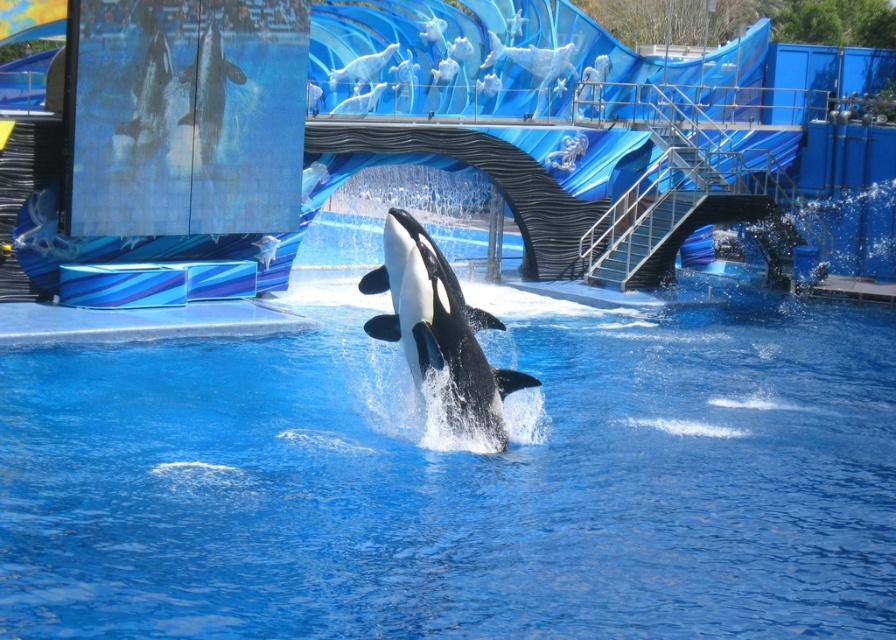
Does black smooth dolphin at upper left have a greater width compared to white smooth dolphin at upper left?

No, black smooth dolphin at upper left is not wider than white smooth dolphin at upper left.

Where is `black smooth dolphin at upper left`? black smooth dolphin at upper left is located at coordinates (145, 108).

Where is `black smooth dolphin at upper left`? Image resolution: width=896 pixels, height=640 pixels. black smooth dolphin at upper left is located at coordinates (145, 108).

In order to click on black smooth dolphin at upper left in this screenshot , I will do `click(145, 108)`.

Does black/white smooth orca at center appear over white smooth dolphin at upper left?

No.

Identify the location of black/white smooth orca at center. (438, 324).

Does point (431, 275) come closer to viewer compared to point (191, 65)?

Yes.

This screenshot has height=640, width=896. What are the coordinates of `black/white smooth orca at center` in the screenshot? It's located at (438, 324).

Can you confirm if blue smooth water at center is positioned to the left of black smooth dolphin at upper left?

No, blue smooth water at center is not to the left of black smooth dolphin at upper left.

The height and width of the screenshot is (640, 896). What do you see at coordinates (461, 481) in the screenshot?
I see `blue smooth water at center` at bounding box center [461, 481].

Find the location of a particular element. blue smooth water at center is located at coordinates (461, 481).

Find the location of `blue smooth water at center`. blue smooth water at center is located at coordinates (461, 481).